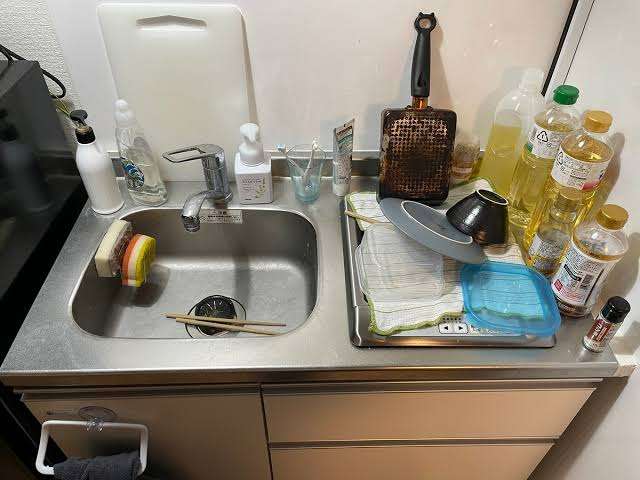
Locate an element on the screen. The height and width of the screenshot is (480, 640). pair of chopsticks is located at coordinates (196, 320).